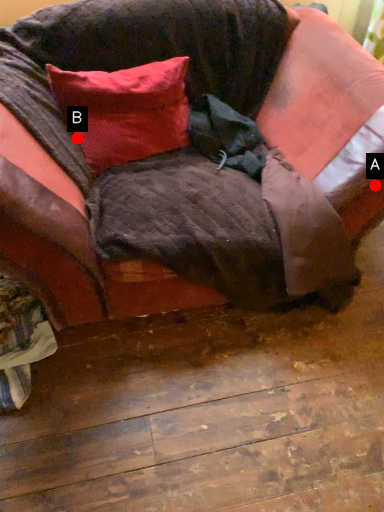
Question: Two points are circled on the image, labeled by A and B beside each circle. Which point is farther from the camera taking this photo?

Choices:
 (A) A is further
 (B) B is further

Answer: (B)